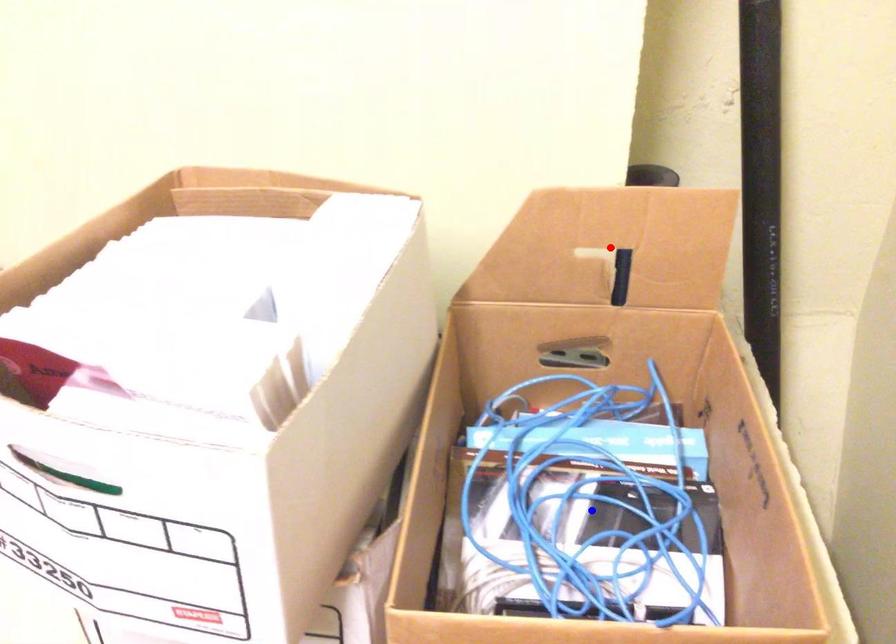
Question: In the image, two points are highlighted. Which point is nearer to the camera? Reply with the corresponding letter.

Choices:
 (A) blue point
 (B) red point

Answer: (A)